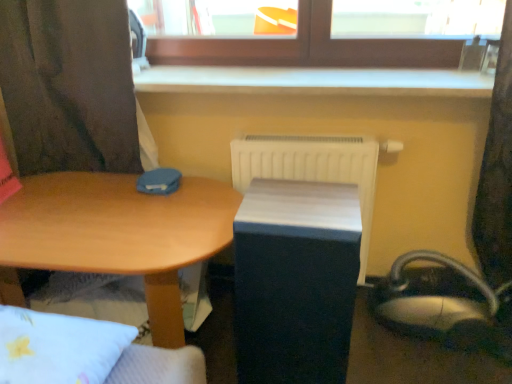
Find the location of `free space above matte black changing table at center (from a real-world perspective)`. free space above matte black changing table at center (from a real-world perspective) is located at coordinates (308, 206).